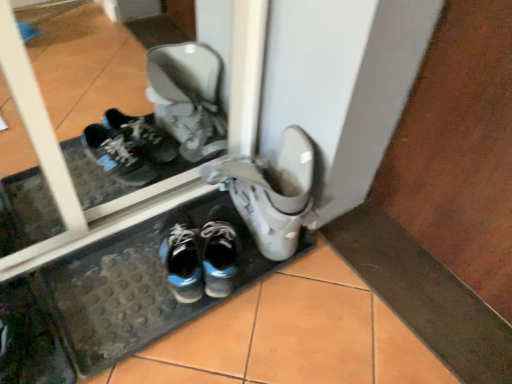
In order to click on free region on the left part of blue synthetic sneakers at center, positioned as the 2th footwear in right-to-left order in this screenshot , I will do `click(136, 264)`.